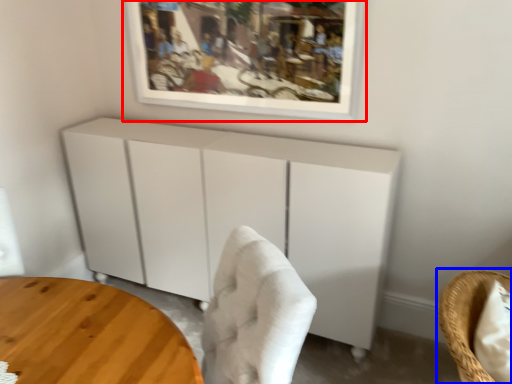
Question: Which object is further to the camera taking this photo, picture frame (highlighted by a red box) or chair (highlighted by a blue box)?

Choices:
 (A) picture frame
 (B) chair

Answer: (A)